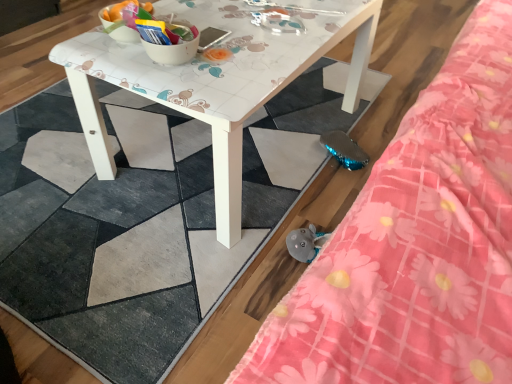
This screenshot has width=512, height=384. Identify the location of free location above white glossy table at center (from a real-world perspective). (252, 30).